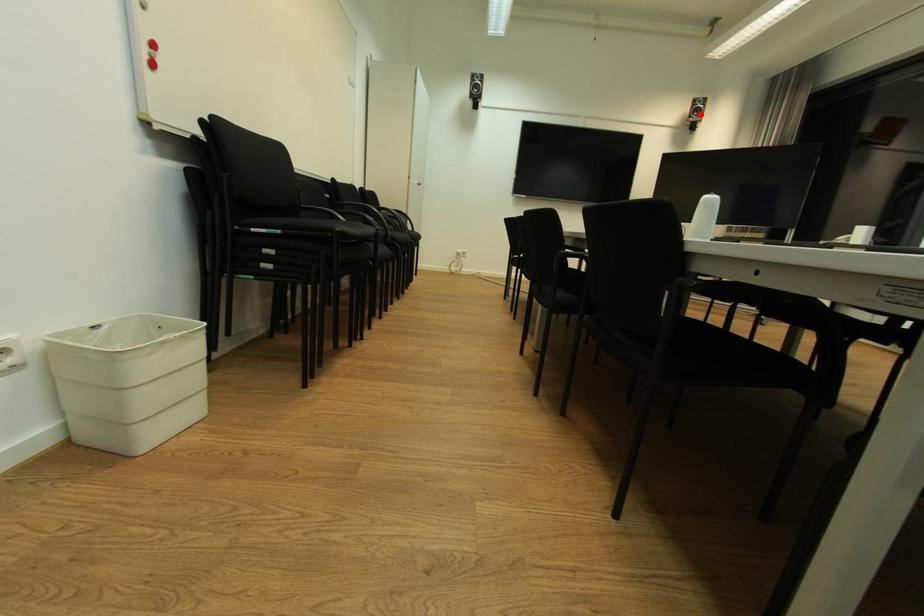
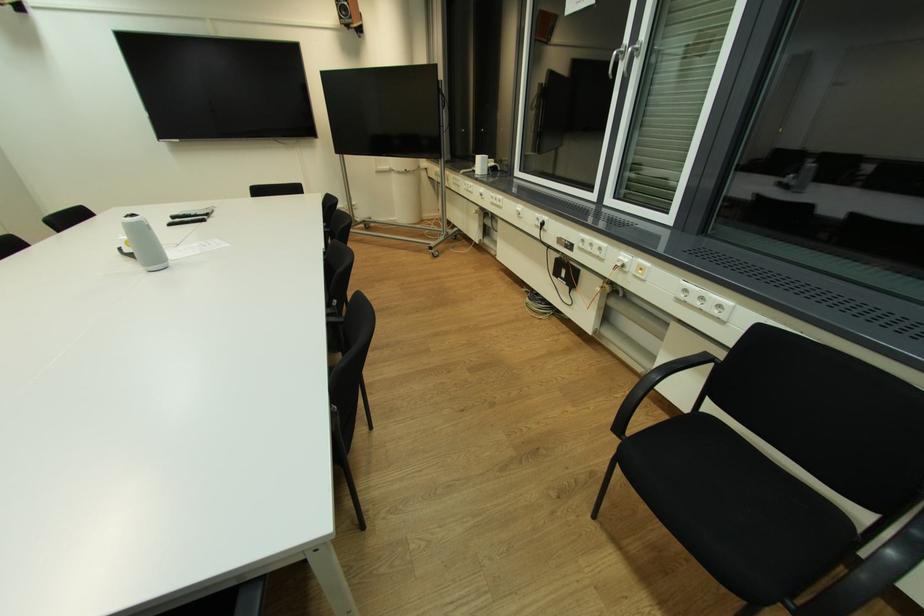
Where in the second image is the point corresponding to the highlighted location from the first image?

(349, 15)